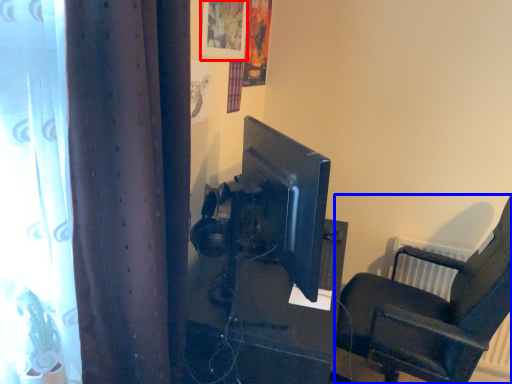
Question: Which point is further to the camera, picture frame (highlighted by a red box) or chair (highlighted by a blue box)?

Choices:
 (A) picture frame
 (B) chair

Answer: (A)